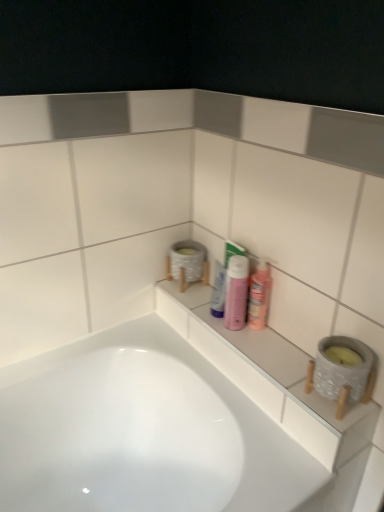
Question: Does pink glossy mouthwash at center, arranged as the first mouthwash when viewed from the right, touch pink matte bottle at center?

Choices:
 (A) yes
 (B) no

Answer: (A)

Question: Is the position of pink glossy mouthwash at center, which is the second mouthwash in left-to-right order, less distant than that of pink matte bottle at center?

Choices:
 (A) no
 (B) yes

Answer: (A)

Question: Is pink glossy mouthwash at center, arranged as the first mouthwash when viewed from the right, not near pink matte bottle at center?

Choices:
 (A) no
 (B) yes

Answer: (A)

Question: Considering the relative positions of pink glossy mouthwash at center, which is the second mouthwash in left-to-right order, and pink matte bottle at center in the image provided, is pink glossy mouthwash at center, which is the second mouthwash in left-to-right order, to the left of pink matte bottle at center from the viewer's perspective?

Choices:
 (A) no
 (B) yes

Answer: (A)

Question: Considering the relative positions of pink glossy mouthwash at center, arranged as the first mouthwash when viewed from the right, and pink matte bottle at center in the image provided, is pink glossy mouthwash at center, arranged as the first mouthwash when viewed from the right, to the right of pink matte bottle at center from the viewer's perspective?

Choices:
 (A) no
 (B) yes

Answer: (B)

Question: From a real-world perspective, is pink glossy mouthwash at center, which is the second mouthwash in left-to-right order, above or below white glossy tube at center, marked as the second mouthwash in a right-to-left arrangement?

Choices:
 (A) above
 (B) below

Answer: (A)

Question: From the image's perspective, is pink glossy mouthwash at center, arranged as the first mouthwash when viewed from the right, located above or below white glossy tube at center, marked as the second mouthwash in a right-to-left arrangement?

Choices:
 (A) above
 (B) below

Answer: (B)

Question: In the image, is pink glossy mouthwash at center, which is the second mouthwash in left-to-right order, on the left side or the right side of white glossy tube at center, the 1th mouthwash from the left?

Choices:
 (A) left
 (B) right

Answer: (B)

Question: Considering their positions, is pink glossy mouthwash at center, arranged as the first mouthwash when viewed from the right, located in front of or behind white glossy tube at center, marked as the second mouthwash in a right-to-left arrangement?

Choices:
 (A) front
 (B) behind

Answer: (A)

Question: Is white ceramic ledge at center to the left or to the right of pink matte bottle at center in the image?

Choices:
 (A) right
 (B) left

Answer: (A)

Question: From the image's perspective, is white ceramic ledge at center located above or below pink matte bottle at center?

Choices:
 (A) below
 (B) above

Answer: (A)

Question: Relative to pink matte bottle at center, is white ceramic ledge at center in front or behind?

Choices:
 (A) front
 (B) behind

Answer: (A)

Question: Do you think white ceramic ledge at center is within pink matte bottle at center, or outside of it?

Choices:
 (A) inside
 (B) outside

Answer: (B)

Question: Considering the positions of white glossy tube at center, marked as the second mouthwash in a right-to-left arrangement, and white ceramic ledge at center in the image, is white glossy tube at center, marked as the second mouthwash in a right-to-left arrangement, bigger or smaller than white ceramic ledge at center?

Choices:
 (A) big
 (B) small

Answer: (B)

Question: From their relative heights in the image, would you say white glossy tube at center, the 1th mouthwash from the left, is taller or shorter than white ceramic ledge at center?

Choices:
 (A) short
 (B) tall

Answer: (B)